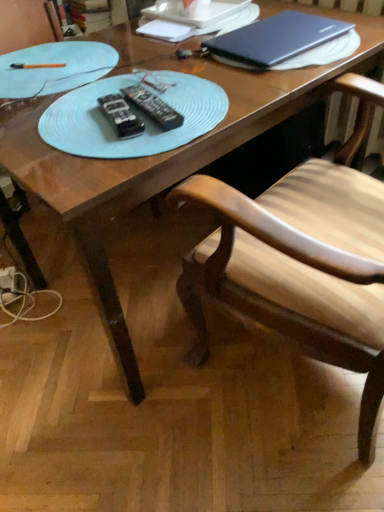
Where is `free space that is in between black plastic remote at center, positioned as the 2th remote in left-to-right order, and light blue plastic plate at upper left`? The height and width of the screenshot is (512, 384). free space that is in between black plastic remote at center, positioned as the 2th remote in left-to-right order, and light blue plastic plate at upper left is located at coordinates (98, 95).